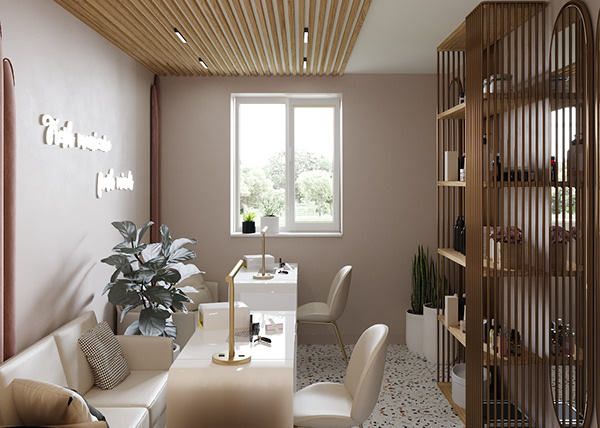
You are a GUI agent. You are given a task and a screenshot of the screen. Output one action in this format:
    pyautogui.click(x=<x>, y=<y>)
    Task: Click on the tan wall
    
    Given the screenshot: What is the action you would take?
    pyautogui.click(x=374, y=132), pyautogui.click(x=37, y=227)